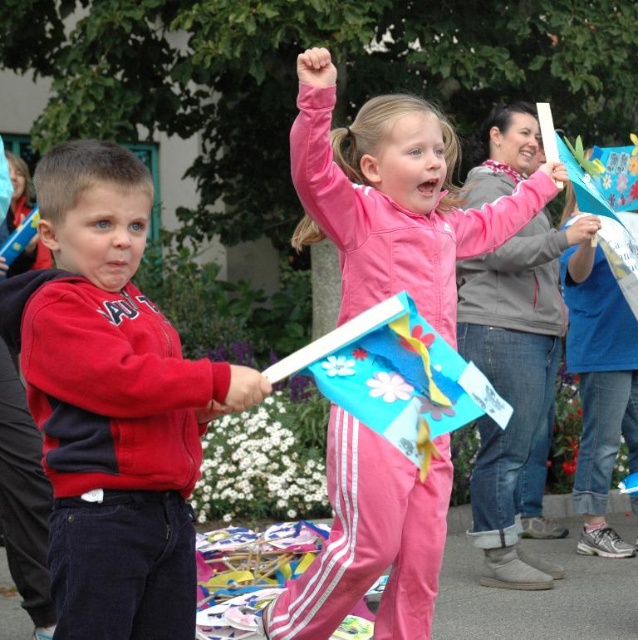
You are a photographer trying to capture a photo of the red fleece jacket at left and the pink matte flag at center. Based on their positions, which object should you focus on first if you want to include both in your shot without moving the camera?

The red fleece jacket at left is to the left of the pink matte flag at center, so you should focus on the red fleece jacket at left first to ensure both are in frame.

Consider the image. You are a photographer trying to capture both the red fleece jacket at left and the pink matte flag at center in a single frame. Based on their sizes, which object should you focus on first to ensure both are in the frame?

The red fleece jacket at left is smaller than the pink matte flag at center, so you should focus on the pink matte flag at center first to ensure both are in the frame.

You are organizing a parade and need to know which object is narrower between the red fleece jacket at left and the pink matte flag at center. Which one should you choose?

The red fleece jacket at left is thinner than the pink matte flag at center, so you should choose the red fleece jacket at left as it is narrower.